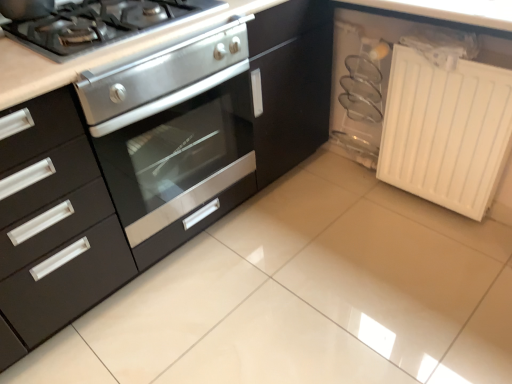
Question: Is stainless steel gas stove at upper left with white matte radiator at lower right?

Choices:
 (A) no
 (B) yes

Answer: (A)

Question: From a real-world perspective, is stainless steel gas stove at upper left on white matte radiator at lower right?

Choices:
 (A) no
 (B) yes

Answer: (B)

Question: Can you confirm if stainless steel gas stove at upper left is smaller than white matte radiator at lower right?

Choices:
 (A) yes
 (B) no

Answer: (A)

Question: From the image's perspective, is stainless steel gas stove at upper left under white matte radiator at lower right?

Choices:
 (A) no
 (B) yes

Answer: (A)

Question: Can you confirm if stainless steel gas stove at upper left is shorter than white matte radiator at lower right?

Choices:
 (A) no
 (B) yes

Answer: (B)

Question: Is stainless steel gas stove at upper left bigger than white matte radiator at lower right?

Choices:
 (A) no
 (B) yes

Answer: (A)

Question: Is stainless steel oven at center taller than white matte radiator at lower right?

Choices:
 (A) yes
 (B) no

Answer: (A)

Question: Considering the relative positions of stainless steel oven at center and white matte radiator at lower right in the image provided, is stainless steel oven at center in front of white matte radiator at lower right?

Choices:
 (A) no
 (B) yes

Answer: (B)

Question: Considering the relative positions of stainless steel oven at center and white matte radiator at lower right in the image provided, is stainless steel oven at center to the right of white matte radiator at lower right from the viewer's perspective?

Choices:
 (A) yes
 (B) no

Answer: (B)

Question: Considering the relative sizes of stainless steel oven at center and white matte radiator at lower right in the image provided, is stainless steel oven at center wider than white matte radiator at lower right?

Choices:
 (A) yes
 (B) no

Answer: (A)

Question: Does stainless steel oven at center appear on the left side of white matte radiator at lower right?

Choices:
 (A) yes
 (B) no

Answer: (A)

Question: Is stainless steel oven at center next to white matte radiator at lower right?

Choices:
 (A) no
 (B) yes

Answer: (A)

Question: Is white matte radiator at lower right looking in the opposite direction of stainless steel oven at center?

Choices:
 (A) yes
 (B) no

Answer: (B)